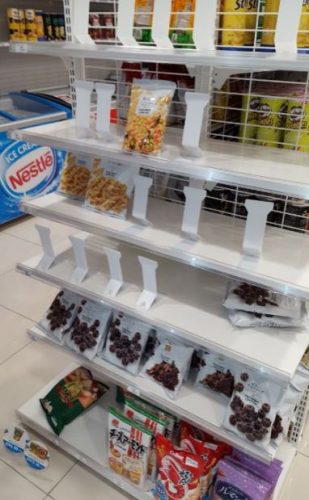
You are a GUI agent. You are given a task and a screenshot of the screen. Output one action in this format:
    pyautogui.click(x=<x>, y=<y>)
    Task: Click on the tile floor
    The height and width of the screenshot is (500, 309).
    Given the screenshot: What is the action you would take?
    pyautogui.click(x=23, y=375)